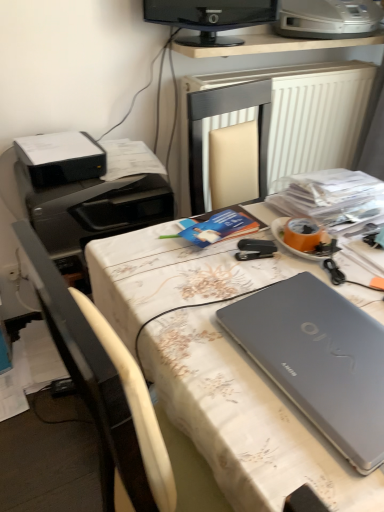
Question: Can you confirm if black plastic printer at upper left, which is the 1th printer from left to right, is wider than white textured radiator at upper center?

Choices:
 (A) no
 (B) yes

Answer: (B)

Question: Is black plastic printer at upper left, arranged as the 2th printer when ordered from the bottom, touching white textured radiator at upper center?

Choices:
 (A) no
 (B) yes

Answer: (A)

Question: From the image's perspective, is black plastic printer at upper left, arranged as the 2th printer when ordered from the bottom, over white textured radiator at upper center?

Choices:
 (A) no
 (B) yes

Answer: (A)

Question: Is black plastic printer at upper left, which is the third printer from right to left, positioned before white textured radiator at upper center?

Choices:
 (A) yes
 (B) no

Answer: (A)

Question: Is black plastic printer at upper left, arranged as the 2th printer when ordered from the bottom, bigger than white textured radiator at upper center?

Choices:
 (A) yes
 (B) no

Answer: (B)

Question: From the image's perspective, is black plastic printer at upper left, arranged as the 2th printer when ordered from the bottom, positioned above or below white fabric-covered desk at center?

Choices:
 (A) below
 (B) above

Answer: (B)

Question: From a real-world perspective, relative to white fabric-covered desk at center, is black plastic printer at upper left, arranged as the 2th printer when ordered from the bottom, vertically above or below?

Choices:
 (A) below
 (B) above

Answer: (B)

Question: Is black plastic printer at upper left, which is the third printer from right to left, taller or shorter than white fabric-covered desk at center?

Choices:
 (A) short
 (B) tall

Answer: (A)

Question: Considering the positions of point (82, 151) and point (266, 220), is point (82, 151) closer or farther from the camera than point (266, 220)?

Choices:
 (A) closer
 (B) farther

Answer: (B)

Question: Is black glossy monitor at upper center wider or thinner than silver metallic printer at upper right, the first printer from the top?

Choices:
 (A) wide
 (B) thin

Answer: (B)

Question: From a real-world perspective, is black glossy monitor at upper center above or below silver metallic printer at upper right, acting as the third printer starting from the left?

Choices:
 (A) above
 (B) below

Answer: (B)

Question: Is black glossy monitor at upper center taller or shorter than silver metallic printer at upper right, which is counted as the 1th printer, starting from the right?

Choices:
 (A) tall
 (B) short

Answer: (A)

Question: Choose the correct answer: Is black glossy monitor at upper center inside silver metallic printer at upper right, which is counted as the 1th printer, starting from the right, or outside it?

Choices:
 (A) inside
 (B) outside

Answer: (B)

Question: Based on their positions, is white fabric-covered desk at center located to the left or right of black glossy monitor at upper center?

Choices:
 (A) left
 (B) right

Answer: (A)

Question: Is white fabric-covered desk at center wider or thinner than black glossy monitor at upper center?

Choices:
 (A) thin
 (B) wide

Answer: (B)